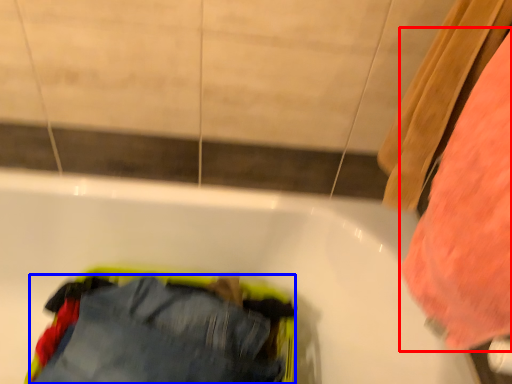
Question: Which object is closer to the camera taking this photo, clothing (highlighted by a red box) or trousers (highlighted by a blue box)?

Choices:
 (A) clothing
 (B) trousers

Answer: (A)